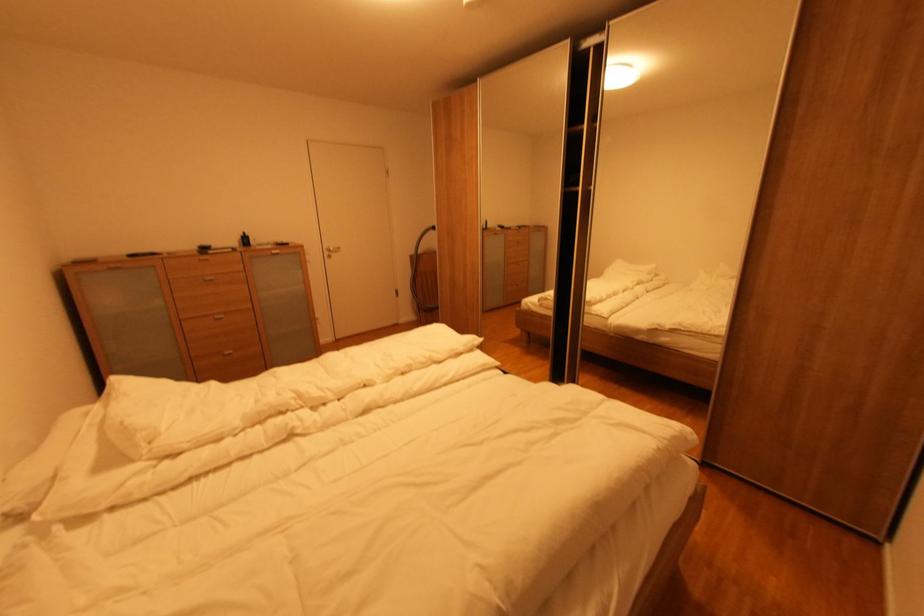
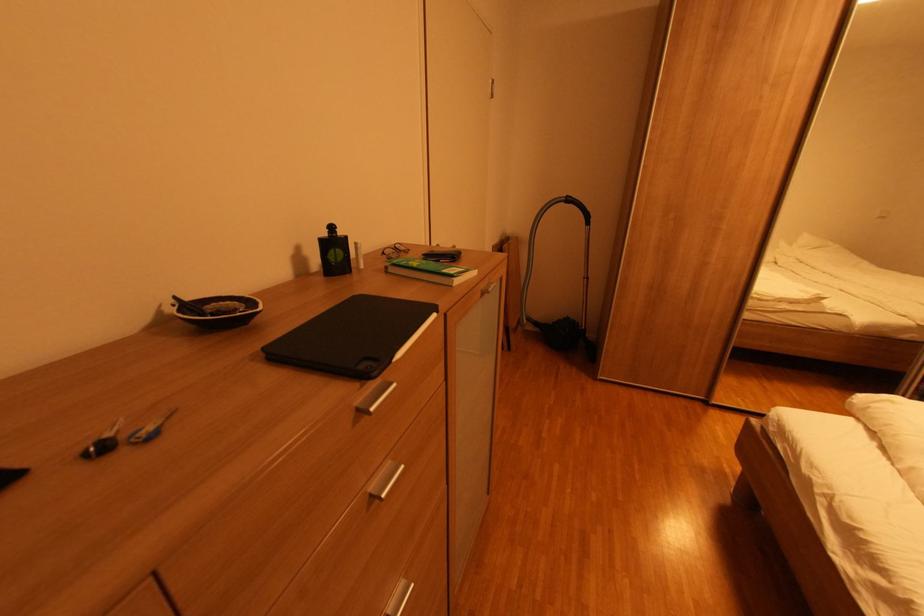
What movement of the cameraman would produce the second image?

The cameraman moved toward left, forward.